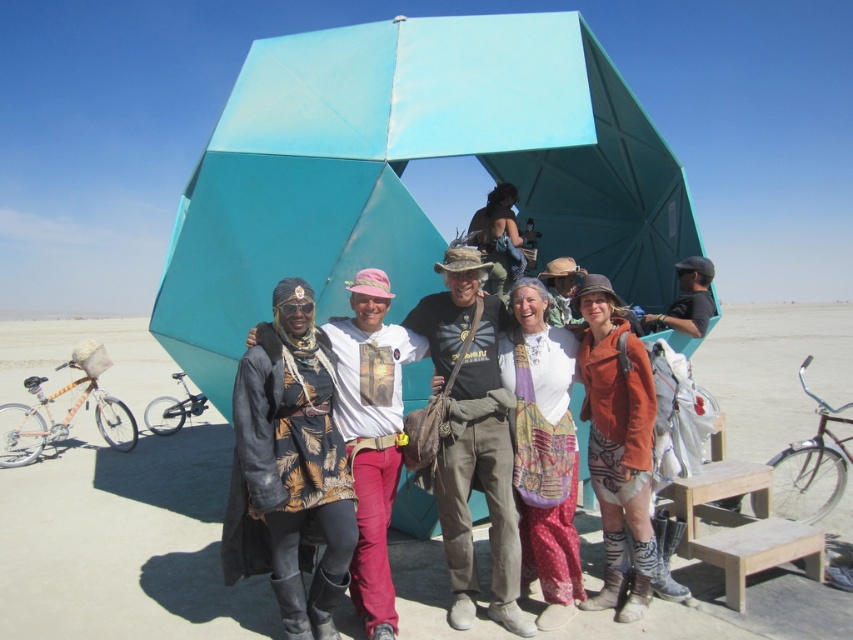
Is matte black jacket at center to the right of light brown wooden picnic table at center from the viewer's perspective?

In fact, matte black jacket at center is to the left of light brown wooden picnic table at center.

Does point (341, 420) come farther from viewer compared to point (718, 499)?

No, it is in front of (718, 499).

This screenshot has width=853, height=640. I want to click on matte black jacket at center, so click(373, 433).

Who is higher up, brown canvas bag at center or light brown wooden picnic table at center?

brown canvas bag at center is higher up.

Is brown canvas bag at center smaller than light brown wooden picnic table at center?

Indeed, brown canvas bag at center has a smaller size compared to light brown wooden picnic table at center.

Image resolution: width=853 pixels, height=640 pixels. In order to click on brown canvas bag at center in this screenshot , I will do `click(473, 436)`.

You are a GUI agent. You are given a task and a screenshot of the screen. Output one action in this format:
    pyautogui.click(x=<x>, y=<y>)
    Task: Click on the brown canvas bag at center
    The image size is (853, 640).
    Given the screenshot: What is the action you would take?
    pyautogui.click(x=473, y=436)

Between leather jacket at center and light brown wooden picnic table at center, which one is positioned lower?

light brown wooden picnic table at center

Which is in front, point (296, 368) or point (757, 500)?

Positioned in front is point (296, 368).

The height and width of the screenshot is (640, 853). Identify the location of leather jacket at center. (281, 451).